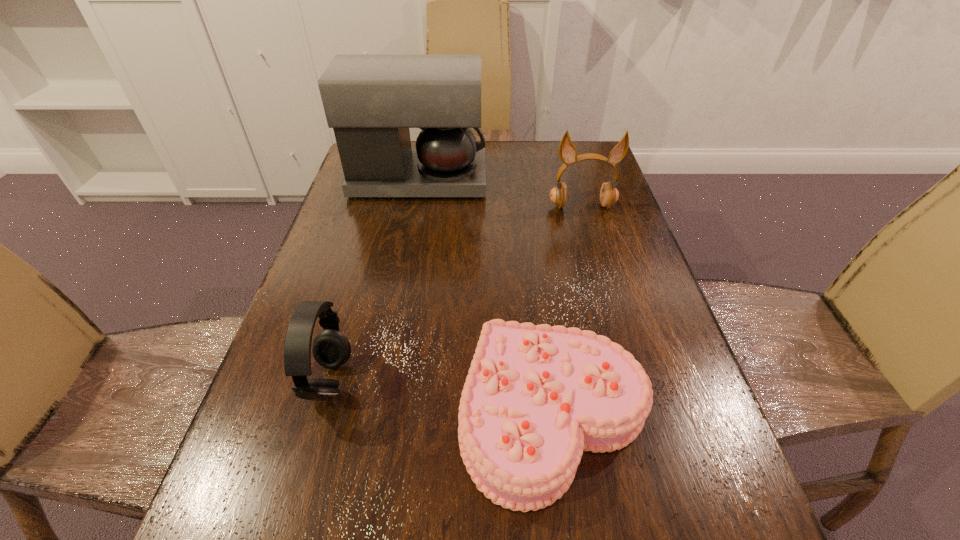
I want to click on the tallest object, so click(370, 100).

Identify the location of the third shortest object. (609, 194).

This screenshot has height=540, width=960. I want to click on the taller earphone, so [609, 194].

Find the location of a particular element. the shorter earphone is located at coordinates tap(331, 349).

I want to click on the second shortest object, so click(331, 349).

This screenshot has width=960, height=540. Identify the location of the shortest object. (535, 397).

At what (x,y) coordinates should I click in order to perform the action: click on blank space located 0.060m on the carafe side of the tallest object. Please return your answer as a coordinate pair (x, y). This screenshot has width=960, height=540. Looking at the image, I should click on (506, 181).

You are a GUI agent. You are given a task and a screenshot of the screen. Output one action in this format:
    pyautogui.click(x=<x>, y=<y>)
    Task: Click on the free space located on the front-facing side of the farther earphone
    
    Given the screenshot: What is the action you would take?
    pyautogui.click(x=602, y=275)

In order to click on free space located on the ear cups of the shorter earphone in this screenshot , I will do `click(398, 382)`.

I want to click on vacant space located on the left of the cake, so click(x=333, y=415).